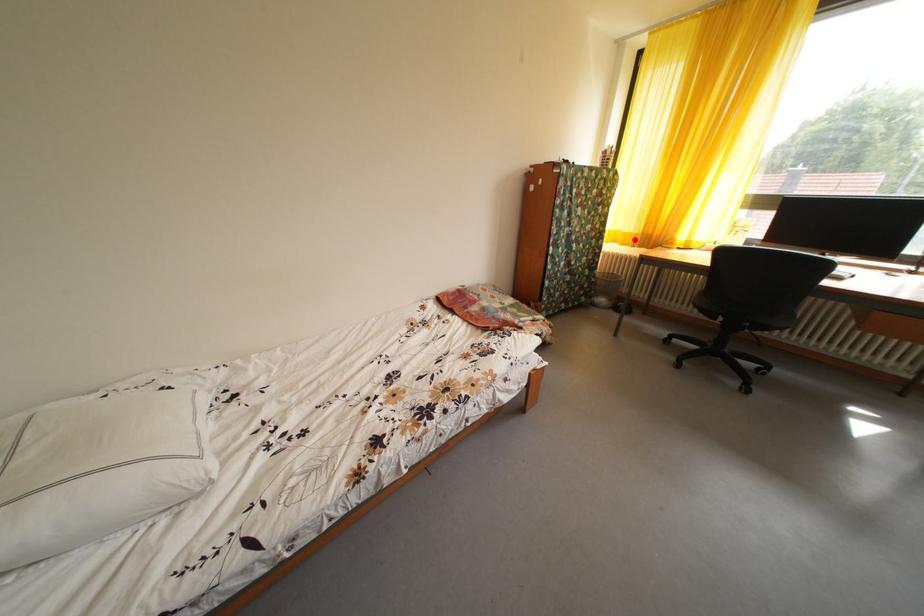
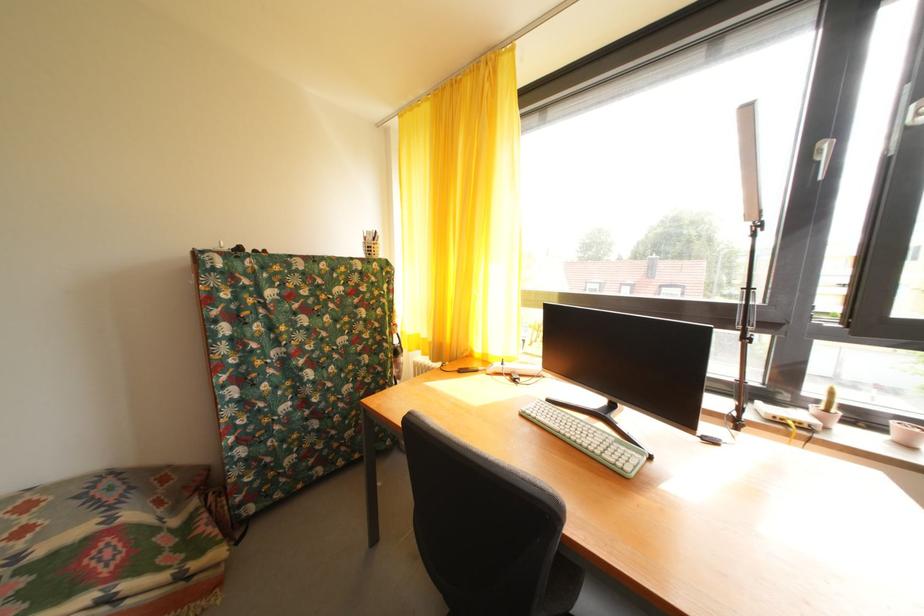
Question: I am providing you with two images of the same scene from different viewpoints. In image1, a red point is highlighted. Considering the same 3D point in image2, which of the following is correct?

Choices:
 (A) It is closer
 (B) It is farther

Answer: (B)